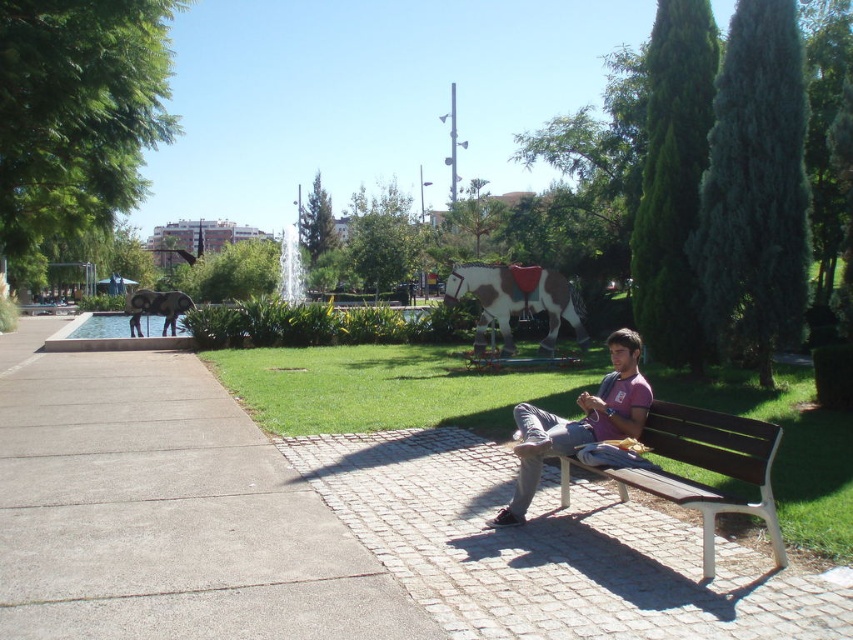
Is point (670, 449) closer to viewer compared to point (190, 307)?

Yes, point (670, 449) is closer to viewer.

Where is `brown wooden bench at center`? The width and height of the screenshot is (853, 640). brown wooden bench at center is located at coordinates (701, 468).

The height and width of the screenshot is (640, 853). Describe the element at coordinates (549, 548) in the screenshot. I see `paved stone bench at center` at that location.

Is paved stone bench at center wider than brown wooden bench at center?

Indeed, paved stone bench at center has a greater width compared to brown wooden bench at center.

Is point (683, 524) in front of point (717, 456)?

No, (683, 524) is further to viewer.

You are a GUI agent. You are given a task and a screenshot of the screen. Output one action in this format:
    pyautogui.click(x=<x>, y=<y>)
    Task: Click on the paved stone bench at center
    This screenshot has width=853, height=640.
    Given the screenshot: What is the action you would take?
    pyautogui.click(x=549, y=548)

Between brown and white painted horse at center and gray matte elephant at left, which one appears on the left side from the viewer's perspective?

Positioned to the left is gray matte elephant at left.

Which is above, brown and white painted horse at center or gray matte elephant at left?

gray matte elephant at left is above.

At what (x,y) coordinates should I click in order to perform the action: click on brown and white painted horse at center. Please return your answer as a coordinate pair (x, y). This screenshot has width=853, height=640. Looking at the image, I should click on (515, 300).

This screenshot has height=640, width=853. I want to click on brown and white painted horse at center, so click(x=515, y=300).